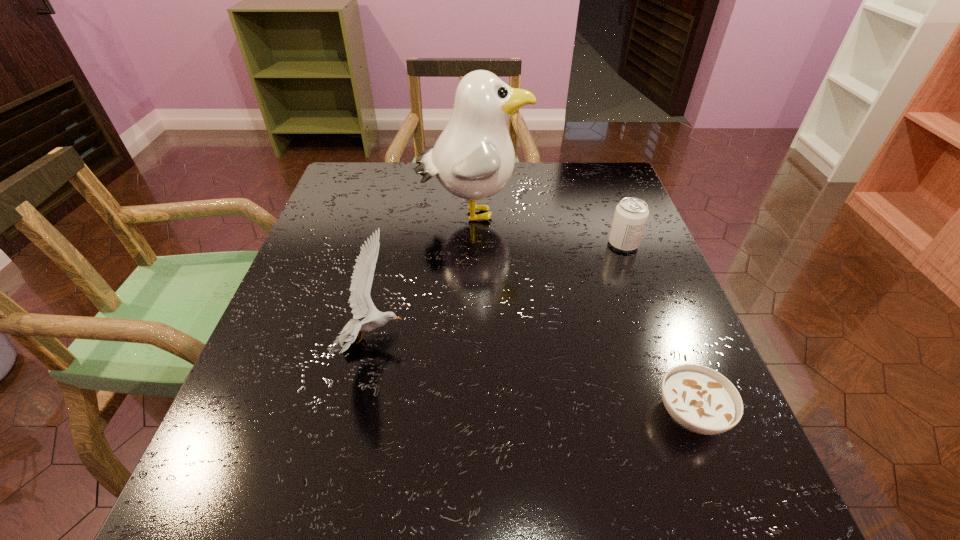
Locate an element on the screen. The image size is (960, 540). the taller gull is located at coordinates coord(473,158).

I want to click on the tallest object, so click(x=473, y=158).

The width and height of the screenshot is (960, 540). I want to click on the nearer gull, so click(x=361, y=304).

Locate an element on the screen. the shorter gull is located at coordinates (361, 304).

At what (x,y) coordinates should I click in order to perform the action: click on the second shortest object. Please return your answer as a coordinate pair (x, y). This screenshot has height=540, width=960. Looking at the image, I should click on (631, 214).

Image resolution: width=960 pixels, height=540 pixels. Find the location of `the shortest object`. the shortest object is located at coordinates (700, 399).

I want to click on free region located on the beak of the tallest object, so click(x=579, y=213).

Find the location of `vacant area located at the tip of the beak of the nearer gull`. vacant area located at the tip of the beak of the nearer gull is located at coordinates (459, 341).

Locate an element on the screen. The width and height of the screenshot is (960, 540). vacant space located 0.060m on the front of the soda can is located at coordinates (634, 271).

At what (x,y) coordinates should I click in order to perform the action: click on vacant region located on the left of the shortest object. Please return your answer as a coordinate pair (x, y). Image resolution: width=960 pixels, height=540 pixels. Looking at the image, I should click on (574, 414).